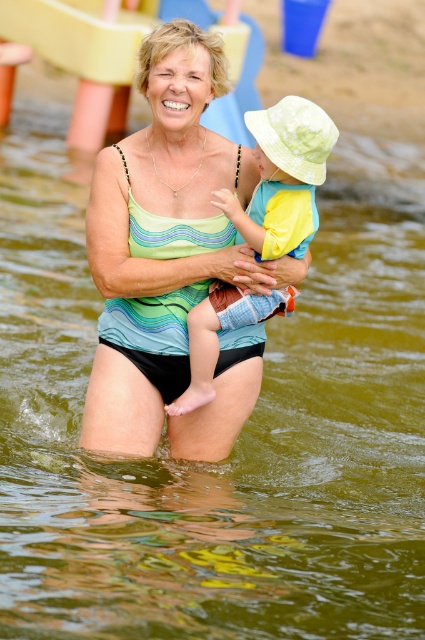
Question: Does matte green tank top at center appear under light blue denim shorts at center?

Choices:
 (A) no
 (B) yes

Answer: (B)

Question: Is matte green tank top at center bigger than light blue denim shorts at center?

Choices:
 (A) no
 (B) yes

Answer: (B)

Question: Which point appears farthest from the camera in this image?

Choices:
 (A) (207, 172)
 (B) (294, 291)

Answer: (B)

Question: Among these points, which one is farthest from the camera?

Choices:
 (A) (153, 118)
 (B) (214, 308)

Answer: (A)

Question: Which object is closer to the camera taking this photo?

Choices:
 (A) light blue denim shorts at center
 (B) matte green tank top at center

Answer: (A)

Question: Observing the image, what is the correct spatial positioning of matte green tank top at center in reference to light blue denim shorts at center?

Choices:
 (A) above
 (B) below

Answer: (B)